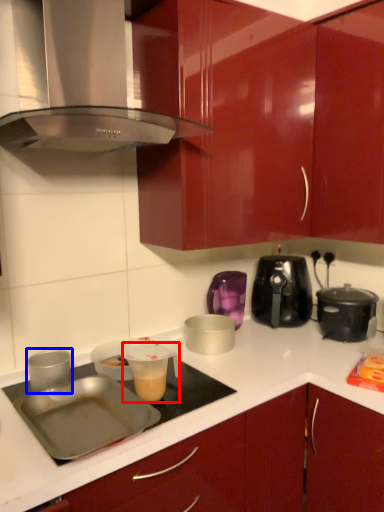
Question: Which object appears farthest to the camera in this image, appliance (highlighted by a red box) or kitchen appliance (highlighted by a blue box)?

Choices:
 (A) appliance
 (B) kitchen appliance

Answer: (B)